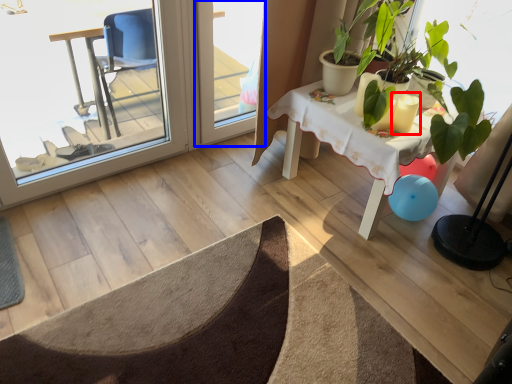
Question: Which object is closer to the camera taking this photo, candle holder (highlighted by a red box) or screen door (highlighted by a blue box)?

Choices:
 (A) candle holder
 (B) screen door

Answer: (A)